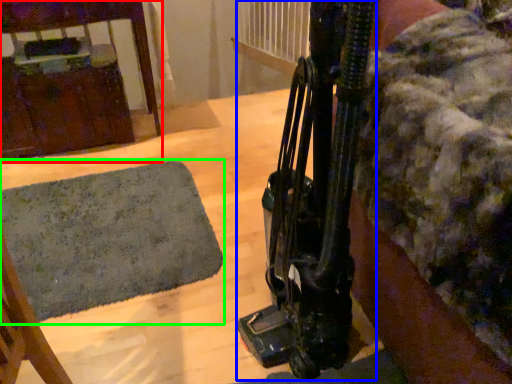
Question: Which object is the closest to the furniture (highlighted by a red box)? Choose among these: equipment (highlighted by a blue box) or mat (highlighted by a green box).

Choices:
 (A) equipment
 (B) mat

Answer: (B)